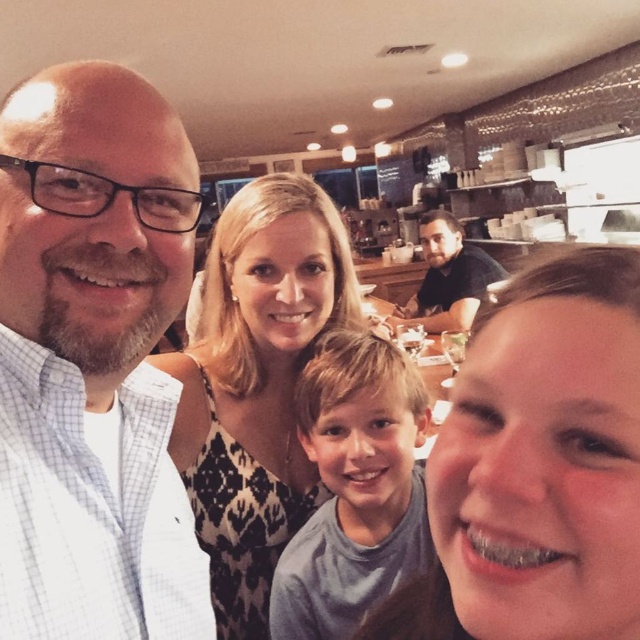
You are a photographer trying to capture a group photo of the scene. You notice the white checkered shirt at left and the dark brown leather jacket at center. Which clothing item appears smaller in width when viewed from your camera position?

The white checkered shirt at left appears smaller in width than the dark brown leather jacket at center because its width is less than the jacket.

In the scene, there are two objects of interest. The first is the smooth skin face at lower right and the second is the black printed dress at center. Which of these two objects is shorter in height?

The smooth skin face at lower right is not as tall as the black printed dress at center, so the smooth skin face at lower right is shorter in height.

You are holding a camera and want to take a closeup photo of the white checkered shirt at left. The camera lens has a minimum focusing distance of 12 inches. Can you take the photo without moving closer?

The distance of white checkered shirt at left from viewer is 17.17 inches. Since 17.17 inches is greater than the minimum focusing distance of 12 inches, you can take the closeup photo without moving closer.